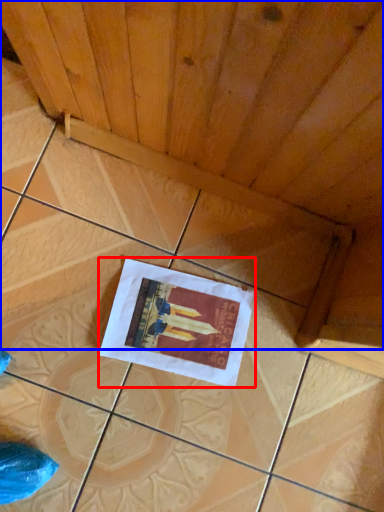
Question: Which object is closer to the camera taking this photo, poster (highlighted by a red box) or plywood (highlighted by a blue box)?

Choices:
 (A) poster
 (B) plywood

Answer: (B)